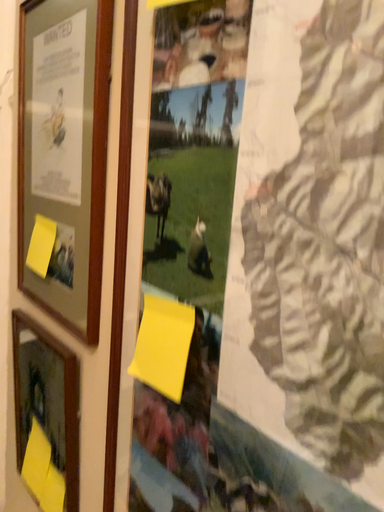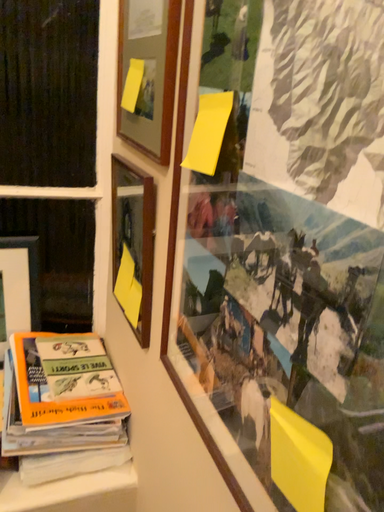
Question: How did the camera likely rotate when shooting the video?

Choices:
 (A) rotated downward
 (B) rotated upward

Answer: (A)